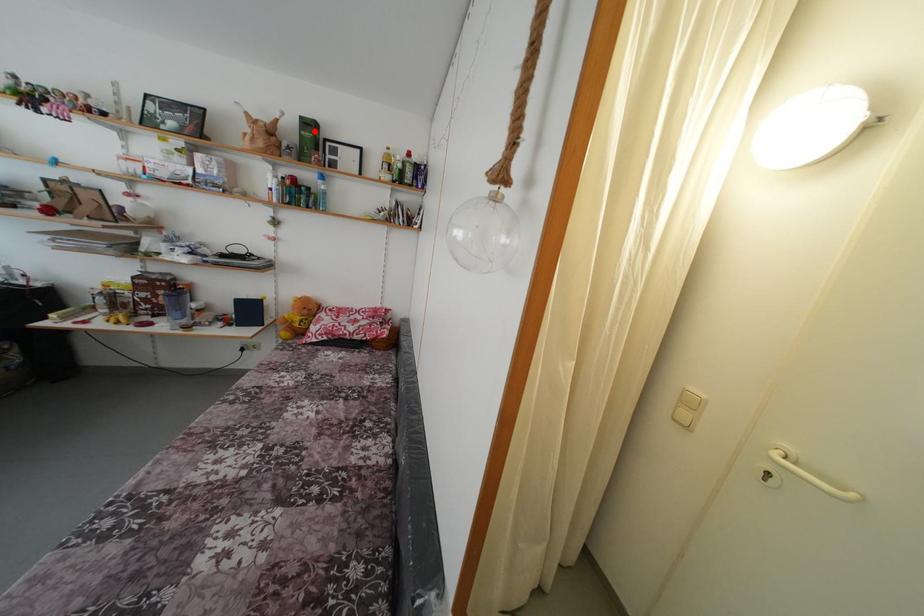
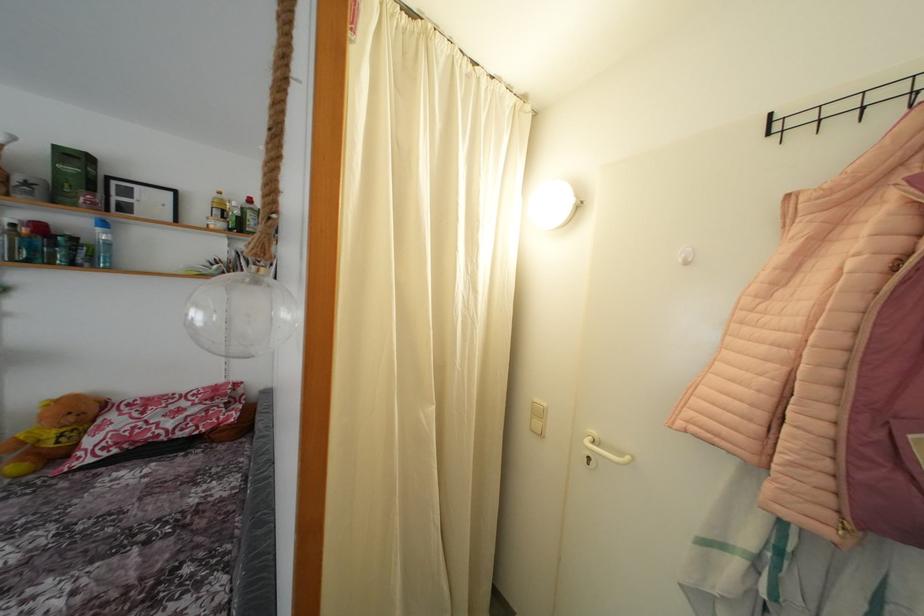
Question: I am providing you with two images of the same scene from different viewpoints. A red point is shown in image1. For the corresponding object point in image2, is it positioned nearer or farther from the camera?

Choices:
 (A) Nearer
 (B) Farther

Answer: (B)